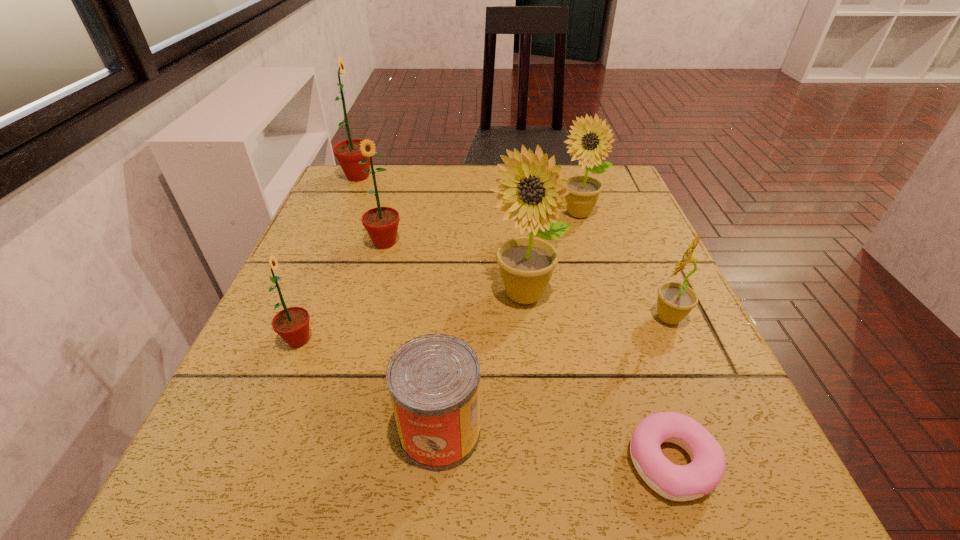
You are a GUI agent. You are given a task and a screenshot of the screen. Output one action in this format:
    pyautogui.click(x=<x>, y=<y>)
    Task: Click on the farthest sunflower
    Image resolution: width=960 pixels, height=540 pixels.
    Given the screenshot: What is the action you would take?
    pyautogui.click(x=347, y=152)

Locate an element on the screen. the farthest green sunflower is located at coordinates (347, 152).

Find the location of `the fourth sunflower from left to right`. the fourth sunflower from left to right is located at coordinates (526, 264).

The image size is (960, 540). I want to click on the fourth object from right to left, so click(x=526, y=264).

Identify the location of the second biggest green sunflower. The image size is (960, 540). (381, 223).

The height and width of the screenshot is (540, 960). I want to click on the rightmost green sunflower, so click(x=381, y=223).

Find the location of a particular element. the farthest yellow sunflower is located at coordinates (588, 147).

At what (x,y) coordinates should I click in order to perform the action: click on the second smallest yellow sunflower. Please return your answer as a coordinate pair (x, y). This screenshot has width=960, height=540. Looking at the image, I should click on (588, 147).

Locate an element on the screen. the rightmost yellow sunflower is located at coordinates (675, 301).

The image size is (960, 540). In order to click on the smallest yellow sunflower in this screenshot , I will do `click(675, 301)`.